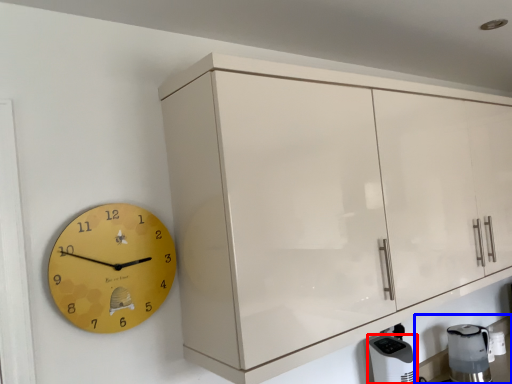
Question: Among these objects, which one is farthest to the camera, appliance (highlighted by a red box) or counter top (highlighted by a blue box)?

Choices:
 (A) appliance
 (B) counter top

Answer: (B)